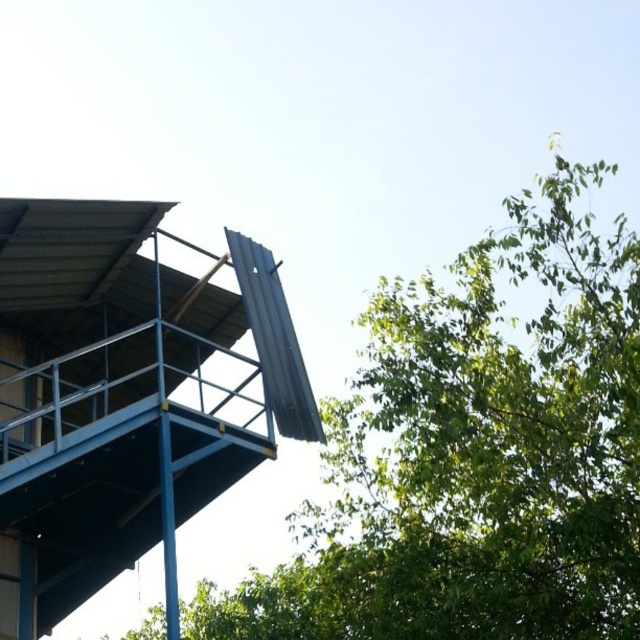
Question: Considering the real-world distances, which object is closest to the metallic blue observation tower at upper left?

Choices:
 (A) green leafy tree at upper right
 (B) blue metallic pole at upper left

Answer: (B)

Question: Does green leafy tree at upper right come behind blue metallic pole at upper left?

Choices:
 (A) yes
 (B) no

Answer: (B)

Question: Can you confirm if green leafy tree at upper right is positioned above blue metallic pole at upper left?

Choices:
 (A) yes
 (B) no

Answer: (B)

Question: In this image, where is green leafy tree at upper right located relative to metallic blue observation tower at upper left?

Choices:
 (A) left
 (B) right

Answer: (B)

Question: Which object is positioned farthest from the blue metallic pole at upper left?

Choices:
 (A) metallic blue observation tower at upper left
 (B) green leafy tree at upper right

Answer: (B)

Question: Which of the following is the closest to the observer?

Choices:
 (A) blue metallic pole at upper left
 (B) metallic blue observation tower at upper left

Answer: (A)